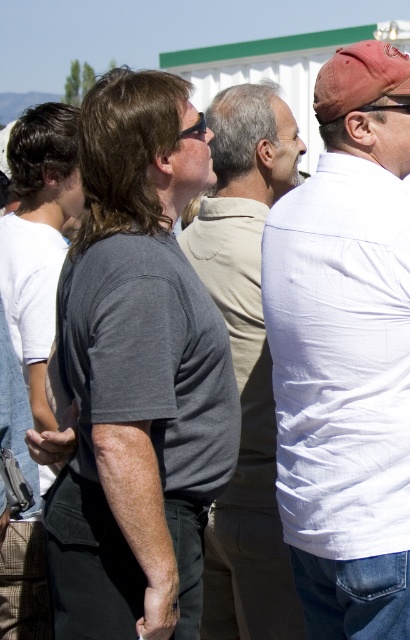
Between point (405, 58) and point (245, 186), which one is positioned behind?

Positioned behind is point (245, 186).

The image size is (410, 640). What are the coordinates of `white cotton shirt at right` in the screenshot? It's located at (346, 352).

Image resolution: width=410 pixels, height=640 pixels. Find the location of `white cotton shirt at right`. white cotton shirt at right is located at coordinates (346, 352).